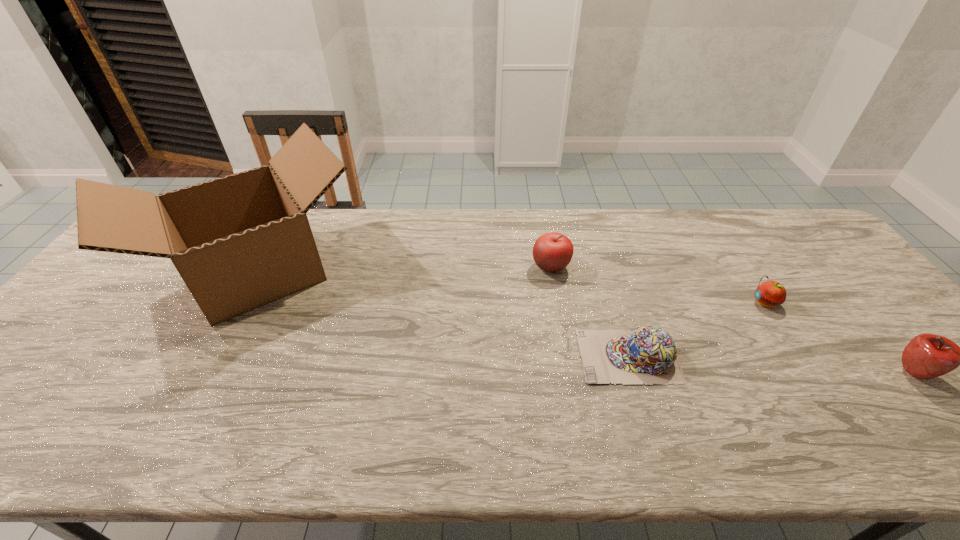
Image resolution: width=960 pixels, height=540 pixels. Identify the location of vacant region at the near edge of the desktop. (230, 460).

You are a GUI agent. You are given a task and a screenshot of the screen. Output one action in this format:
    pyautogui.click(x=<x>, y=<y>)
    Task: Click on the blank space at the left edge of the desktop
    This screenshot has width=960, height=540.
    Given the screenshot: What is the action you would take?
    pyautogui.click(x=121, y=296)

Where is `vacant space at the right edge of the desktop`? vacant space at the right edge of the desktop is located at coordinates (845, 288).

In the image, there is a desktop. Identify the location of free space at the far right corner. (803, 241).

The width and height of the screenshot is (960, 540). In order to click on empty location between the cap and the box in this screenshot , I will do `click(443, 314)`.

Identify the location of empty location between the farthest apple and the shortest apple. This screenshot has height=540, width=960. (658, 285).

Image resolution: width=960 pixels, height=540 pixels. I want to click on vacant area that lies between the farthest apple and the rightmost apple, so click(x=732, y=320).

In order to click on vacant area between the second nearest apple and the farthest apple in this screenshot , I will do `click(658, 285)`.

I want to click on vacant area between the rightmost object and the leftmost object, so click(586, 322).

Find the location of a particular element. vacant region between the farthest apple and the fourth object from left to right is located at coordinates (658, 285).